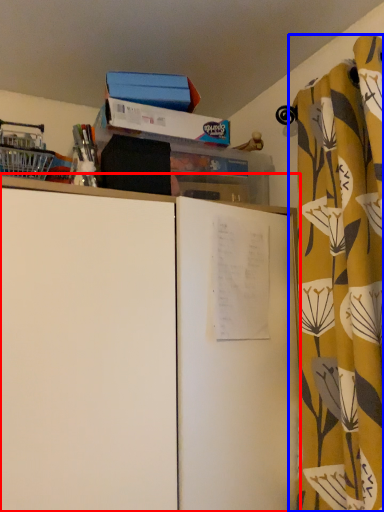
Question: Which object appears closest to the camera in this image, cupboard (highlighted by a red box) or curtain (highlighted by a blue box)?

Choices:
 (A) cupboard
 (B) curtain

Answer: (A)